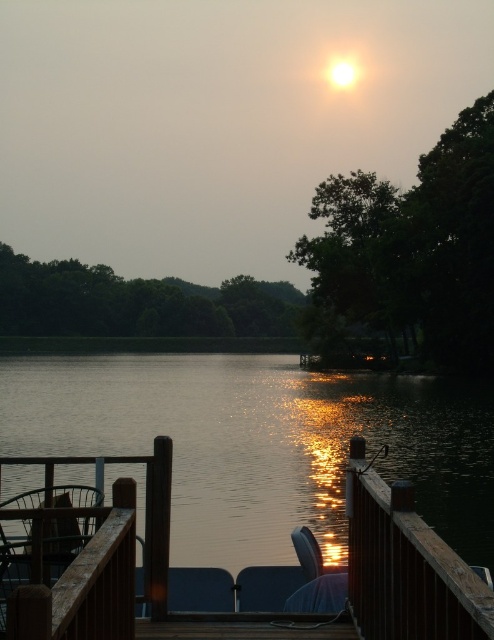
You are a person who is 1.6 meters tall. You want to sit on one of the chairs at the lakeside dock. Which chair, the matte plastic chair at lower center or the matte blue chair at lower center, would be more comfortable for you to sit on without needing to adjust your height?

The matte plastic chair at lower center is taller than the matte blue chair at lower center. Since you are 1.6 meters tall, the matte blue chair at lower center would be more comfortable as it is shorter and closer to your height, requiring less adjustment.